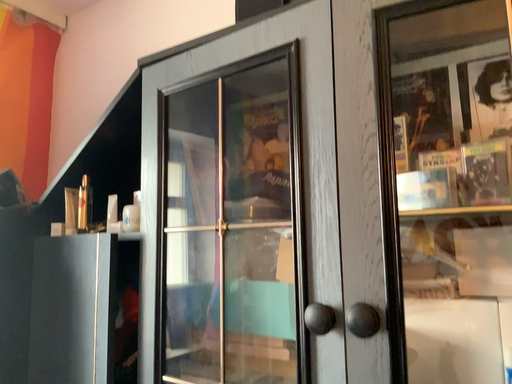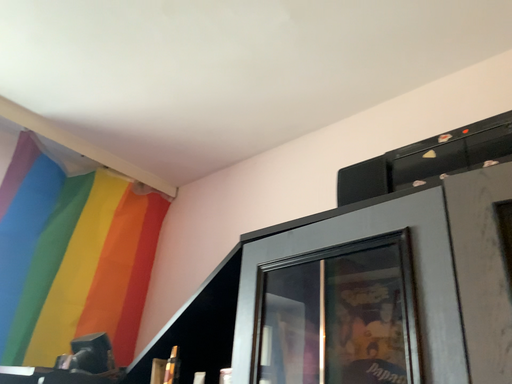
Question: Which way did the camera rotate in the video?

Choices:
 (A) rotated left
 (B) rotated right

Answer: (A)